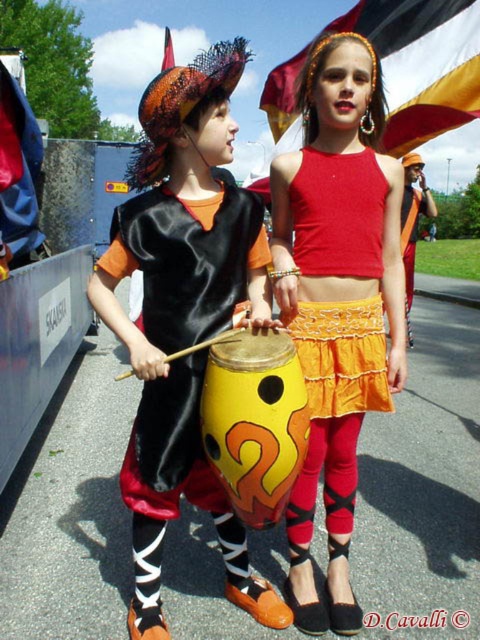
Question: Can you confirm if orange lace skirt at center is positioned above yellow fabric flag at upper center?

Choices:
 (A) yes
 (B) no

Answer: (B)

Question: Which object is positioned farthest from the shiny black vest at center?

Choices:
 (A) yellow fabric flag at upper center
 (B) red fabric flag at upper center
 (C) orange lace skirt at center
 (D) yellow matte drum at center

Answer: (B)

Question: Which of the following is the farthest from the observer?

Choices:
 (A) (166, 44)
 (B) (427, 28)
 (C) (356, 186)

Answer: (A)

Question: Is shiny black vest at center positioned before yellow matte drum at center?

Choices:
 (A) no
 (B) yes

Answer: (A)

Question: Is shiny black vest at center wider than matte red tank top at center?

Choices:
 (A) no
 (B) yes

Answer: (A)

Question: Which point is farther to the camera?

Choices:
 (A) yellow matte drum at center
 (B) yellow fabric flag at upper center
 (C) matte red tank top at center
 (D) orange lace skirt at center

Answer: (B)